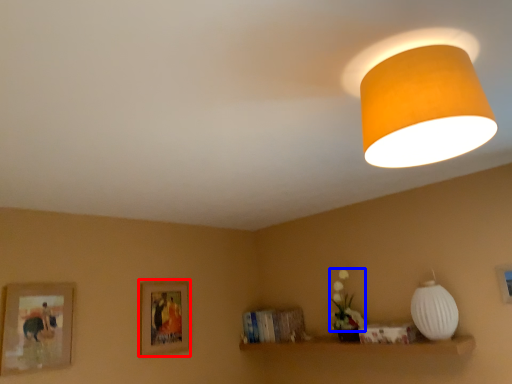
Question: Among these objects, which one is nearest to the camera, picture frame (highlighted by a red box) or flower (highlighted by a blue box)?

Choices:
 (A) picture frame
 (B) flower

Answer: (B)